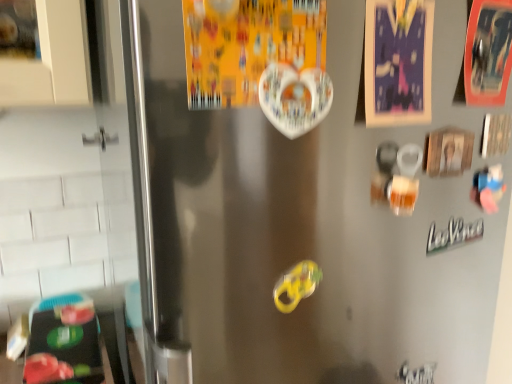
Question: Should I look upward or downward to see orange cardboard postcard at upper right, which is the 3th postcard from left to right?

Choices:
 (A) down
 (B) up

Answer: (B)

Question: From the image's perspective, is green metallic sticker at lower right above orange cardboard postcard at upper right, the 1th postcard in the right-to-left sequence?

Choices:
 (A) no
 (B) yes

Answer: (A)

Question: Can you confirm if green metallic sticker at lower right is smaller than orange cardboard postcard at upper right, which is the 3th postcard from left to right?

Choices:
 (A) no
 (B) yes

Answer: (B)

Question: Would you say green metallic sticker at lower right is a long distance from orange cardboard postcard at upper right, which is the 3th postcard from left to right?

Choices:
 (A) no
 (B) yes

Answer: (A)

Question: Is green metallic sticker at lower right with orange cardboard postcard at upper right, which is the 3th postcard from left to right?

Choices:
 (A) yes
 (B) no

Answer: (B)

Question: Does green metallic sticker at lower right have a greater width compared to orange cardboard postcard at upper right, which is the 3th postcard from left to right?

Choices:
 (A) yes
 (B) no

Answer: (B)

Question: Is green metallic sticker at lower right closer to camera compared to orange cardboard postcard at upper right, which is the 3th postcard from left to right?

Choices:
 (A) yes
 (B) no

Answer: (B)

Question: Considering the relative sizes of orange cardboard postcard at upper right, the 1th postcard in the right-to-left sequence, and yellow rubber band at center in the image provided, is orange cardboard postcard at upper right, the 1th postcard in the right-to-left sequence, wider than yellow rubber band at center?

Choices:
 (A) no
 (B) yes

Answer: (B)

Question: Does orange cardboard postcard at upper right, the 1th postcard in the right-to-left sequence, appear on the left side of yellow rubber band at center?

Choices:
 (A) yes
 (B) no

Answer: (B)

Question: Is orange cardboard postcard at upper right, which is the 3th postcard from left to right, next to yellow rubber band at center?

Choices:
 (A) no
 (B) yes

Answer: (A)

Question: Is orange cardboard postcard at upper right, the 1th postcard in the right-to-left sequence, closer to the viewer compared to yellow rubber band at center?

Choices:
 (A) yes
 (B) no

Answer: (B)

Question: Considering the relative sizes of orange cardboard postcard at upper right, the 1th postcard in the right-to-left sequence, and yellow rubber band at center in the image provided, is orange cardboard postcard at upper right, the 1th postcard in the right-to-left sequence, bigger than yellow rubber band at center?

Choices:
 (A) yes
 (B) no

Answer: (A)

Question: Can you confirm if orange cardboard postcard at upper right, which is the 3th postcard from left to right, is smaller than yellow rubber band at center?

Choices:
 (A) no
 (B) yes

Answer: (A)

Question: Does yellow rubber band at center lie behind white glossy heart at upper center, marked as the first postcard in a left-to-right arrangement?

Choices:
 (A) yes
 (B) no

Answer: (A)